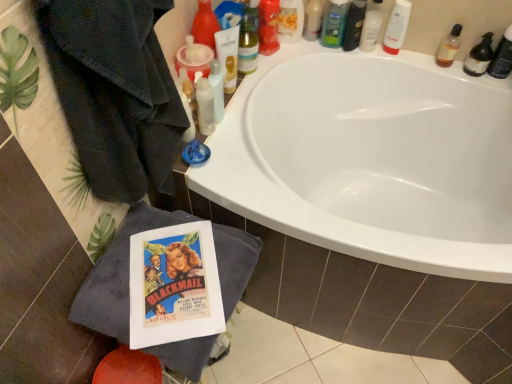
You are a GUI agent. You are given a task and a screenshot of the screen. Output one action in this format:
    pyautogui.click(x=<x>, y=<y>)
    Task: Click on the blank space above vintage paper comic book at lower left (from a real-world perspective)
    Image resolution: width=512 pixels, height=384 pixels.
    Given the screenshot: What is the action you would take?
    pyautogui.click(x=175, y=272)